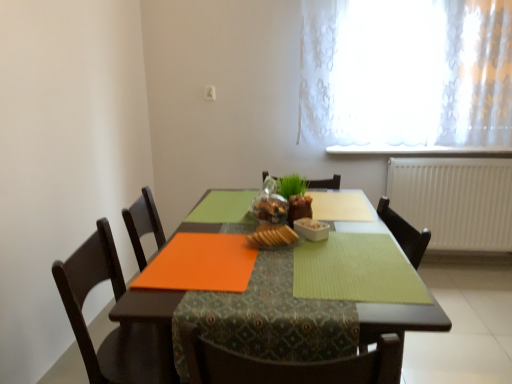
This screenshot has height=384, width=512. Find the location of `free space above orange matte placemat at center, which is counted as the first place mat, starting from the left (from a real-world perspective)`. free space above orange matte placemat at center, which is counted as the first place mat, starting from the left (from a real-world perspective) is located at coordinates click(x=203, y=256).